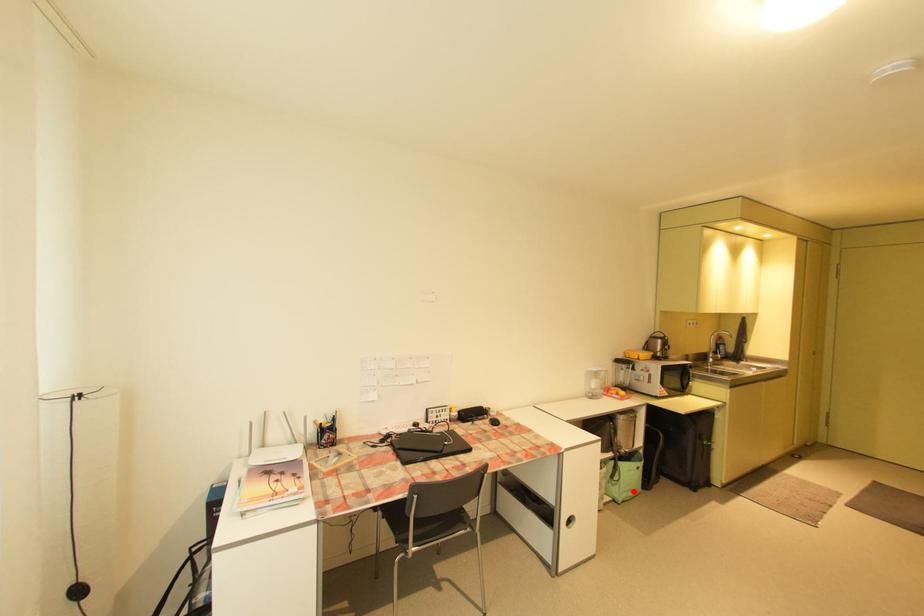
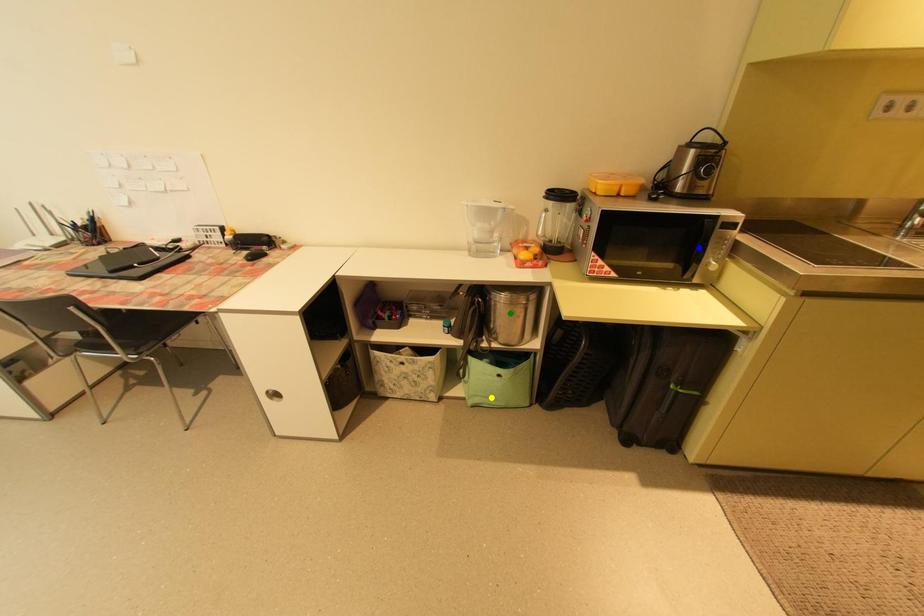
Question: I am providing you with two images of the same scene from different viewpoints. A red point is marked on the first image. You are given multiple points on the second image. Which mark in image 2 goes with the point in image 1?

Choices:
 (A) yellow point
 (B) blue point
 (C) green point

Answer: (A)